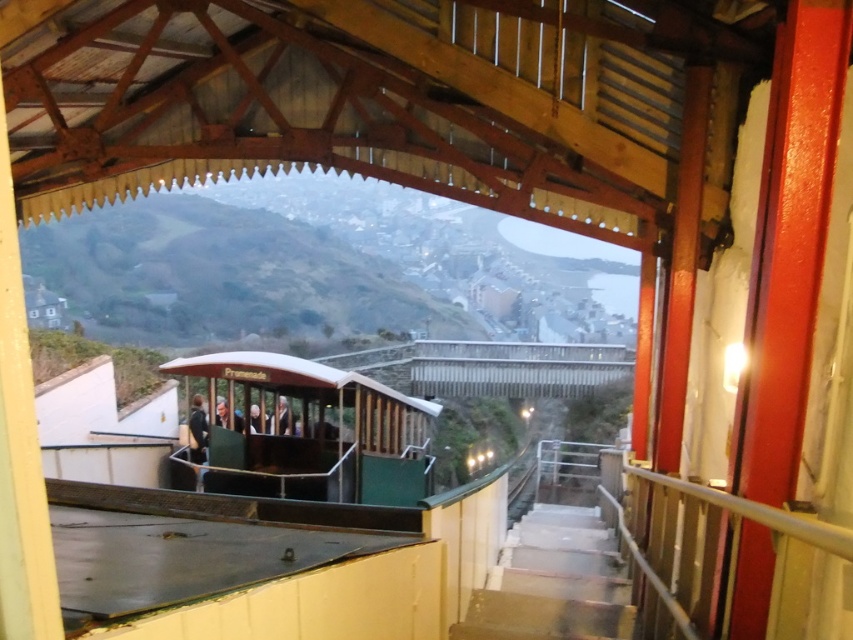
Question: Based on their relative distances, which object is farther from the smooth skin face at center?

Choices:
 (A) white fabric coat at center
 (B) white concrete stairs at lower right

Answer: (B)

Question: Among these points, which one is nearest to the camera?

Choices:
 (A) (198, 394)
 (B) (248, 424)
 (C) (286, 417)
 (D) (312, 365)

Answer: (D)

Question: Can you confirm if smooth beige coat at center is bigger than white fabric coat at center?

Choices:
 (A) no
 (B) yes

Answer: (B)

Question: Is green matte train car at center positioned behind white concrete stairs at lower right?

Choices:
 (A) no
 (B) yes

Answer: (B)

Question: Considering the relative positions of white concrete stairs at lower right and smooth beige coat at center in the image provided, where is white concrete stairs at lower right located with respect to smooth beige coat at center?

Choices:
 (A) right
 (B) left

Answer: (A)

Question: Considering the real-world distances, which object is farthest from the smooth skin face at center?

Choices:
 (A) white fabric coat at center
 (B) white concrete stairs at lower right

Answer: (B)